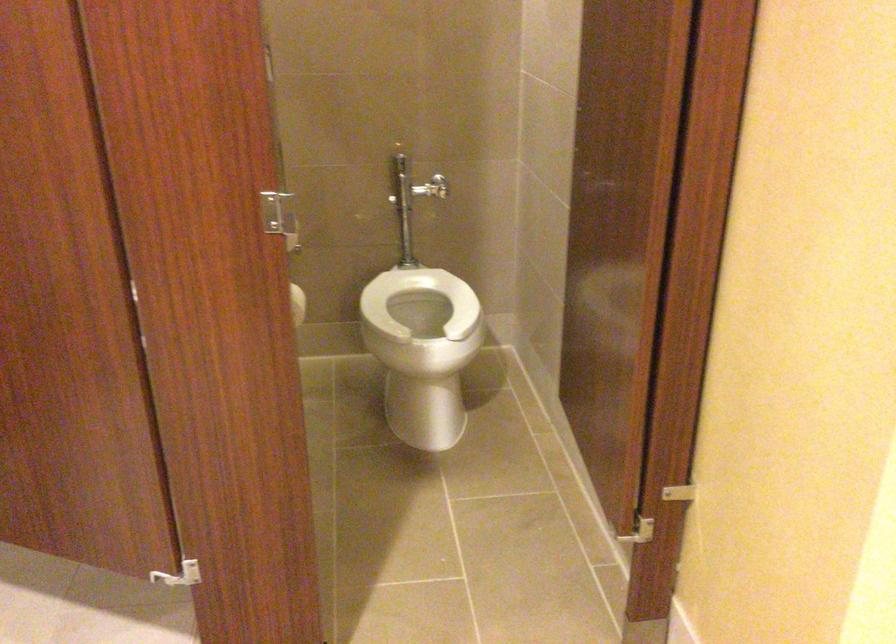
Where would you lift the white toilet seat? Please return your answer as a coordinate pair (x, y).

(419, 301)